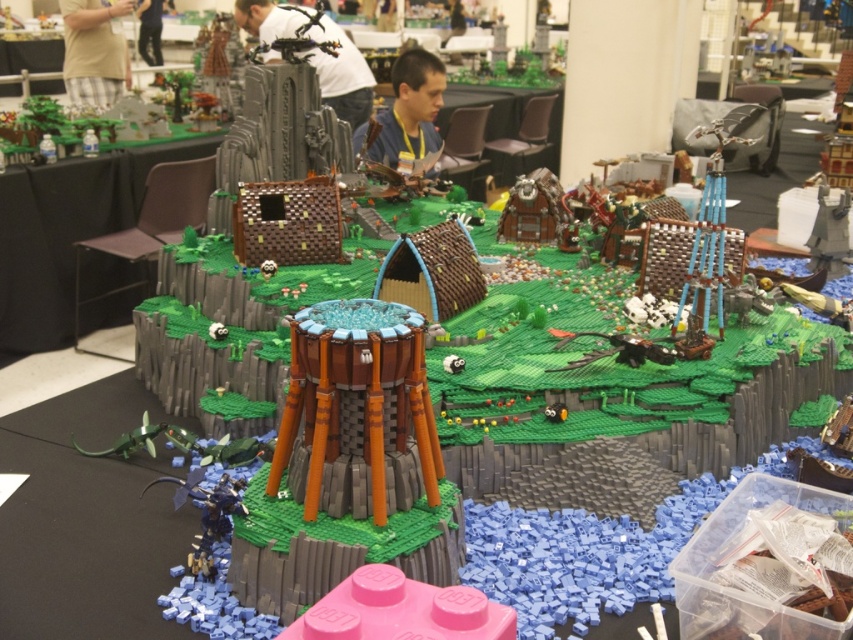
Question: Can you confirm if brown textured tower at center is wider than green grassy hill at upper left?

Choices:
 (A) yes
 (B) no

Answer: (B)

Question: Can you confirm if brown textured tower at center is positioned to the left of green grassy hill at upper left?

Choices:
 (A) yes
 (B) no

Answer: (B)

Question: In this image, where is brown textured tower at center located relative to green grassy hill at upper left?

Choices:
 (A) left
 (B) right

Answer: (B)

Question: Which of the following is the farthest from the observer?

Choices:
 (A) green grassy hill at upper left
 (B) brown textured tower at center

Answer: (A)